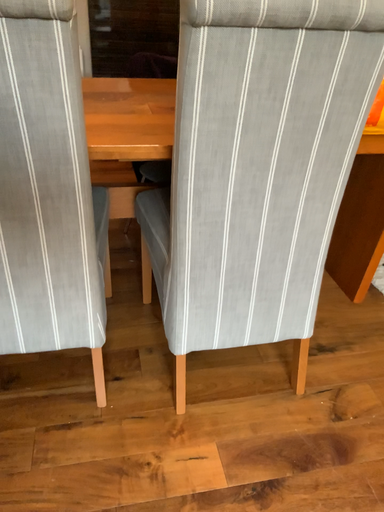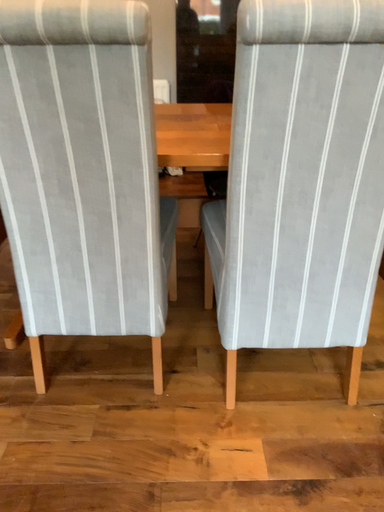
Question: How did the camera likely rotate when shooting the video?

Choices:
 (A) rotated right
 (B) rotated left

Answer: (B)